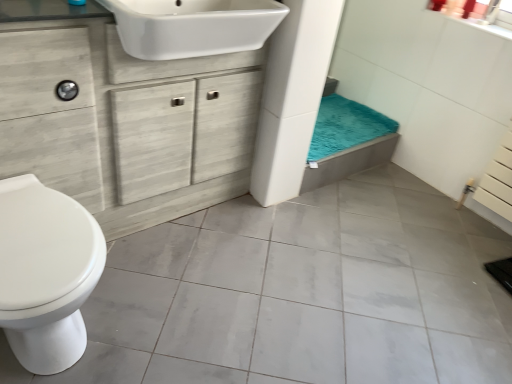
This screenshot has width=512, height=384. Describe the element at coordinates (122, 117) in the screenshot. I see `white wood cabinet at center` at that location.

What is the approximate height of white glossy toilet at left?

white glossy toilet at left is 18.08 inches in height.

Locate an element on the screen. This screenshot has height=384, width=512. white wood cabinet at center is located at coordinates pyautogui.click(x=122, y=117).

From the image's perspective, does white glossy toilet at left appear higher than teal plush bath towel at center?

Incorrect, from the image's perspective, white glossy toilet at left is lower than teal plush bath towel at center.

From a real-world perspective, is white glossy toilet at left above or below teal plush bath towel at center?

In terms of real-world spatial position, white glossy toilet at left is above teal plush bath towel at center.

How different are the orientations of white glossy toilet at left and teal plush bath towel at center in degrees?

0.0215 degrees.

Does point (76, 305) lie behind point (342, 109)?

No, (76, 305) is closer to viewer.

Considering the relative sizes of white glossy toilet at left and white wood cabinet at center in the image provided, is white glossy toilet at left bigger than white wood cabinet at center?

Actually, white glossy toilet at left might be smaller than white wood cabinet at center.

Considering the relative sizes of white glossy toilet at left and white wood cabinet at center in the image provided, is white glossy toilet at left taller than white wood cabinet at center?

In fact, white glossy toilet at left may be shorter than white wood cabinet at center.

Which is farther, (x=26, y=228) or (x=104, y=126)?

Positioned behind is point (x=104, y=126).

Which object is positioned more to the right, white glossy toilet at left or white wood cabinet at center?

From the viewer's perspective, white wood cabinet at center appears more on the right side.

Can you confirm if white glossy sink at upper center is positioned to the right of teal plush bath towel at center?

No, white glossy sink at upper center is not to the right of teal plush bath towel at center.

Which point is more forward, (162, 35) or (359, 116)?

The point (162, 35) is in front.

Considering the relative sizes of white glossy sink at upper center and teal plush bath towel at center in the image provided, is white glossy sink at upper center taller than teal plush bath towel at center?

Correct, white glossy sink at upper center is much taller as teal plush bath towel at center.

From the image's perspective, which is below, white wood cabinet at center or white glossy toilet at left?

white glossy toilet at left, from the image's perspective.

Does white wood cabinet at center have a greater height compared to white glossy toilet at left?

Yes.

Measure the distance from white wood cabinet at center to white glossy toilet at left.

white wood cabinet at center is 16.83 inches away from white glossy toilet at left.

Is white wood cabinet at center to the right of white glossy toilet at left from the viewer's perspective?

Yes.

Between white glossy sink at upper center and white wood cabinet at center, which one has larger width?

white glossy sink at upper center.

From the image's perspective, is white glossy sink at upper center located above or below white wood cabinet at center?

white glossy sink at upper center is above white wood cabinet at center.

Where is `sink on the right side of white wood cabinet at center`? The image size is (512, 384). sink on the right side of white wood cabinet at center is located at coordinates (193, 26).

Identify the location of bathroom cabinet that appears below the white glossy sink at upper center (from the image's perspective). Image resolution: width=512 pixels, height=384 pixels. (122, 117).

Considering the sizes of objects white wood cabinet at center and white glossy sink at upper center in the image provided, who is thinner, white wood cabinet at center or white glossy sink at upper center?

With smaller width is white wood cabinet at center.

From a real-world perspective, is white wood cabinet at center physically located above or below white glossy sink at upper center?

From a real-world perspective, white wood cabinet at center is physically below white glossy sink at upper center.

Can you confirm if white wood cabinet at center is taller than white glossy sink at upper center?

Yes, white wood cabinet at center is taller than white glossy sink at upper center.

Which is nearer, (340, 138) or (36, 349)?

Point (340, 138) is farther from the camera than point (36, 349).

I want to click on toilet lying below the teal plush bath towel at center (from the image's perspective), so click(46, 273).

Is teal plush bath towel at center taller or shorter than white glossy toilet at left?

In the image, teal plush bath towel at center appears to be shorter than white glossy toilet at left.

Is teal plush bath towel at center aimed at white glossy toilet at left?

No.

This screenshot has height=384, width=512. Find the location of `bath towel located underneath the white glossy toilet at left (from a real-world perspective)`. bath towel located underneath the white glossy toilet at left (from a real-world perspective) is located at coordinates (346, 127).

In the image, there is a white wood cabinet at center. What are the coordinates of `toilet below it (from the image's perspective)` in the screenshot? It's located at (46, 273).

From the picture: Looking at the image, which one is located further to teal plush bath towel at center, white glossy toilet at left or white glossy sink at upper center?

Among the two, white glossy toilet at left is located further to teal plush bath towel at center.

From the image, which object appears to be nearer to white glossy toilet at left, white glossy sink at upper center or white wood cabinet at center?

white wood cabinet at center lies closer to white glossy toilet at left than the other object.

Which object lies further to the anchor point white glossy sink at upper center, teal plush bath towel at center or white wood cabinet at center?

teal plush bath towel at center is positioned further to the anchor white glossy sink at upper center.

When comparing their distances from white glossy sink at upper center, does white glossy toilet at left or white wood cabinet at center seem closer?

white wood cabinet at center is closer to white glossy sink at upper center.

When comparing their distances from white glossy sink at upper center, does white wood cabinet at center or white glossy toilet at left seem further?

white glossy toilet at left is further to white glossy sink at upper center.

Based on their spatial positions, is white glossy sink at upper center or white glossy toilet at left further from white wood cabinet at center?

The object further to white wood cabinet at center is white glossy toilet at left.

Which object lies further to the anchor point teal plush bath towel at center, white glossy sink at upper center or white glossy toilet at left?

white glossy toilet at left is further to teal plush bath towel at center.

Looking at the image, which one is located further to white glossy toilet at left, white wood cabinet at center or white glossy sink at upper center?

white glossy sink at upper center.

Find the location of a particular element. This screenshot has width=512, height=384. bathroom cabinet positioned between white glossy toilet at left and teal plush bath towel at center from near to far is located at coordinates (122, 117).

Identify the location of sink between white wood cabinet at center and teal plush bath towel at center in the front-back direction. This screenshot has width=512, height=384. (193, 26).

Image resolution: width=512 pixels, height=384 pixels. Find the location of `bathroom cabinet between white glossy sink at upper center and white glossy toilet at left in the up-down direction`. bathroom cabinet between white glossy sink at upper center and white glossy toilet at left in the up-down direction is located at coordinates (122, 117).

This screenshot has height=384, width=512. Identify the location of sink between white glossy toilet at left and teal plush bath towel at center along the z-axis. (193, 26).